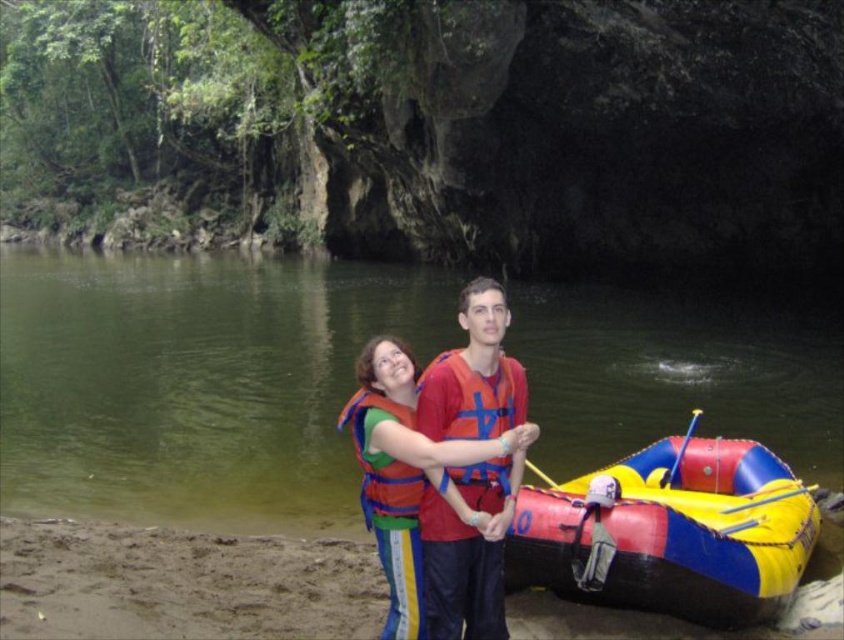
You are standing on the sandy riverbank and want to pick up the rubberized inflatable raft at lower right. Can you reach it without moving your feet?

The rubberized inflatable raft at lower right is 6.46 meters away from viewer. Since the average person can only reach about 1 meter without moving their feet, you cannot reach it without moving your feet.

You are a photographer positioned behind the two individuals on the sandy riverbank. You want to take a photo that clearly shows both the matte orange life vest at center and the orange life jacket at center. Which of the two items should you focus on first to ensure both are in sharp focus?

You should focus on the matte orange life vest at center first because it is closer to you than the orange life jacket at center. By focusing on the closer object, the farther one will also be in focus due to the depth of field.